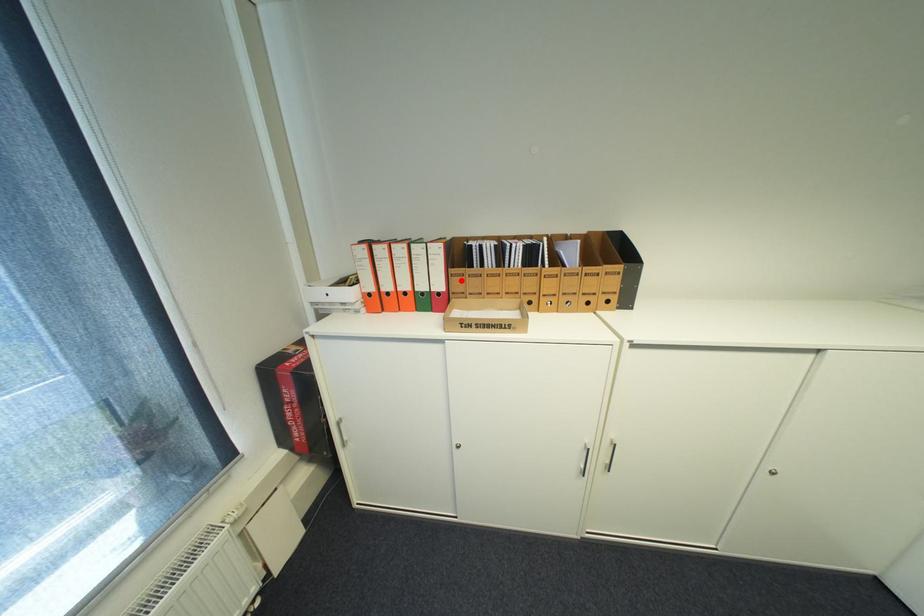
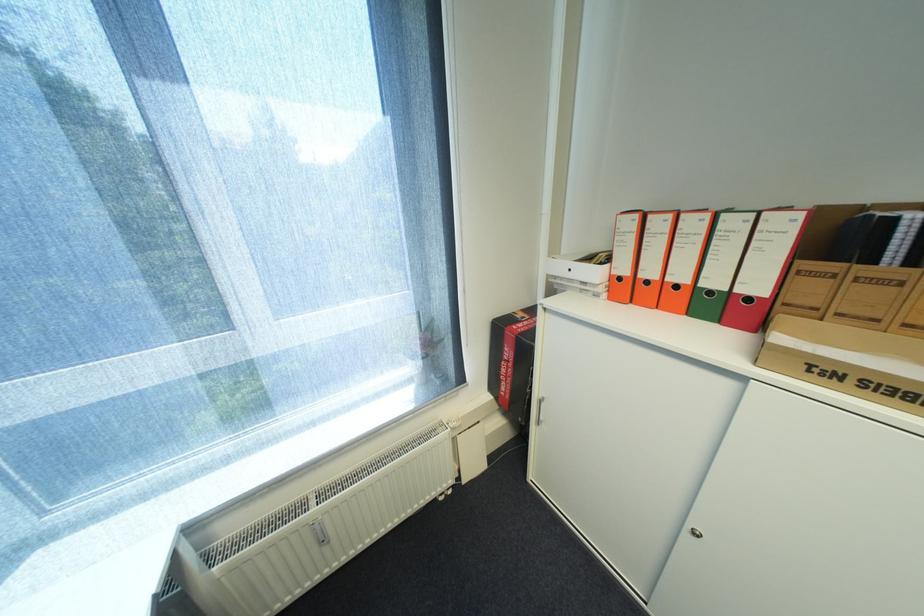
Where in the second image is the point corresponding to the highlighted location from the first image?

(806, 282)